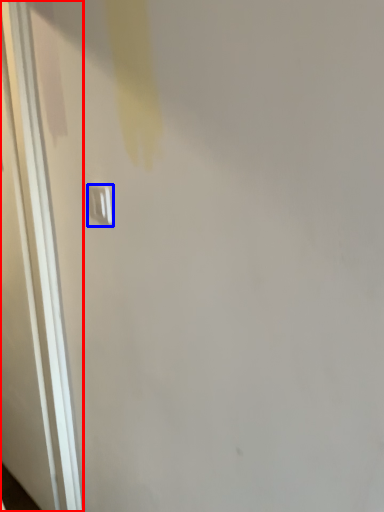
Question: Which object appears farthest to the camera in this image, door (highlighted by a red box) or light switch (highlighted by a blue box)?

Choices:
 (A) door
 (B) light switch

Answer: (A)